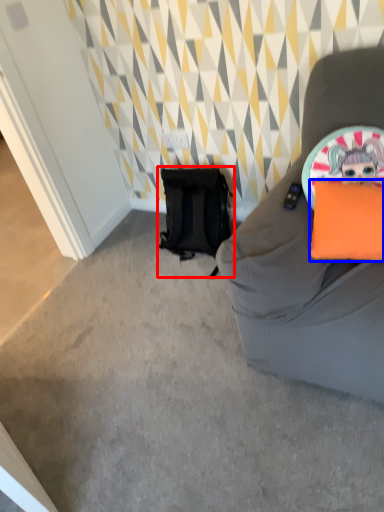
Question: Which object is closer to the camera taking this photo, backpack (highlighted by a red box) or pillow (highlighted by a blue box)?

Choices:
 (A) backpack
 (B) pillow

Answer: (B)